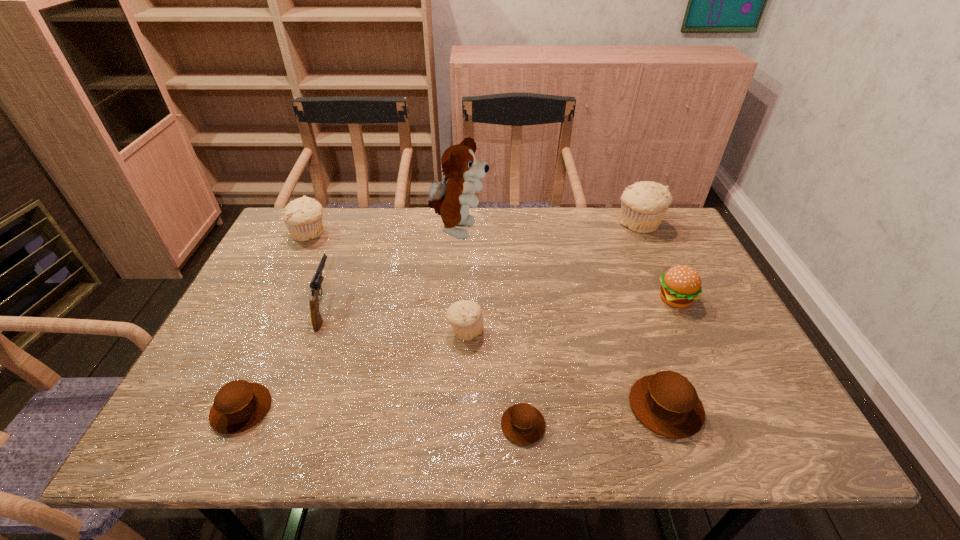
Locate an element on the screen. The image size is (960, 540). vacant space located 0.310m along the barrel of the gun is located at coordinates (357, 219).

You are a GUI agent. You are given a task and a screenshot of the screen. Output one action in this format:
    pyautogui.click(x=<x>, y=<y>)
    Task: Click on the vacant space located along the barrel of the gun
    Image resolution: width=960 pixels, height=540 pixels.
    Given the screenshot: What is the action you would take?
    pyautogui.click(x=338, y=269)

Locate an element on the screen. vacant region located on the back of the hamburger is located at coordinates (654, 253).

Where is `free space located 0.220m on the front of the smallest beige muffin`? Image resolution: width=960 pixels, height=540 pixels. free space located 0.220m on the front of the smallest beige muffin is located at coordinates (462, 430).

Identify the location of free spot located 0.140m on the back of the biggest brown muffin. (638, 329).

Locate an element on the screen. blank space located 0.160m on the right of the leftmost brown muffin is located at coordinates (348, 409).

Locate an element on the screen. The image size is (960, 540). vacant space located on the right of the fourth object from right to left is located at coordinates (733, 425).

Find the location of a particular element. The image size is (960, 540). puppy that is at the far edge is located at coordinates (452, 200).

The width and height of the screenshot is (960, 540). I want to click on muffin located at the right edge, so click(643, 204).

Image resolution: width=960 pixels, height=540 pixels. Find the location of `hamburger located in the right edge section of the desktop`. hamburger located in the right edge section of the desktop is located at coordinates (680, 286).